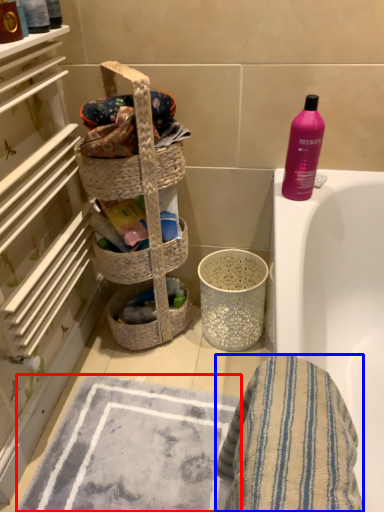
Question: Which of the following is the farthest to the observer, bath mat (highlighted by a red box) or bath towel (highlighted by a blue box)?

Choices:
 (A) bath mat
 (B) bath towel

Answer: (A)